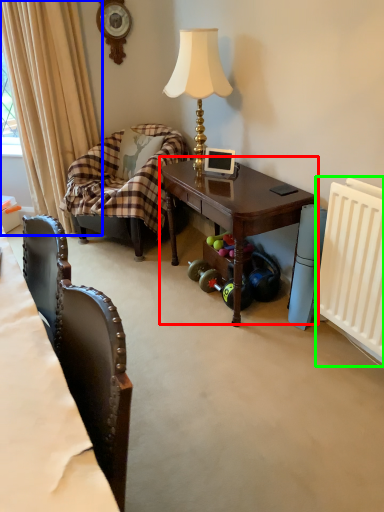
Question: Considering the real-world distances, which object is farthest from table (highlighted by a red box)? curtain (highlighted by a blue box) or radiator (highlighted by a green box)?

Choices:
 (A) curtain
 (B) radiator

Answer: (A)